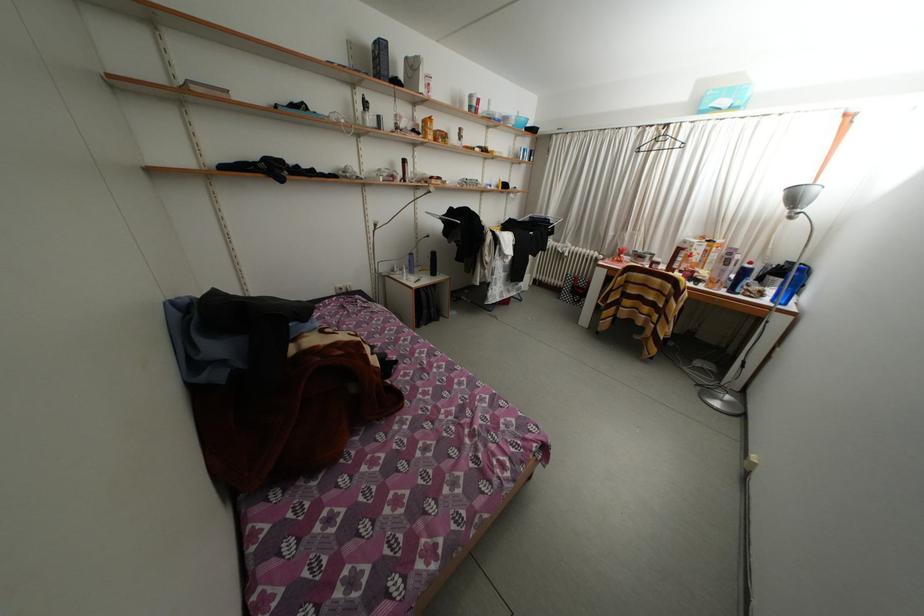
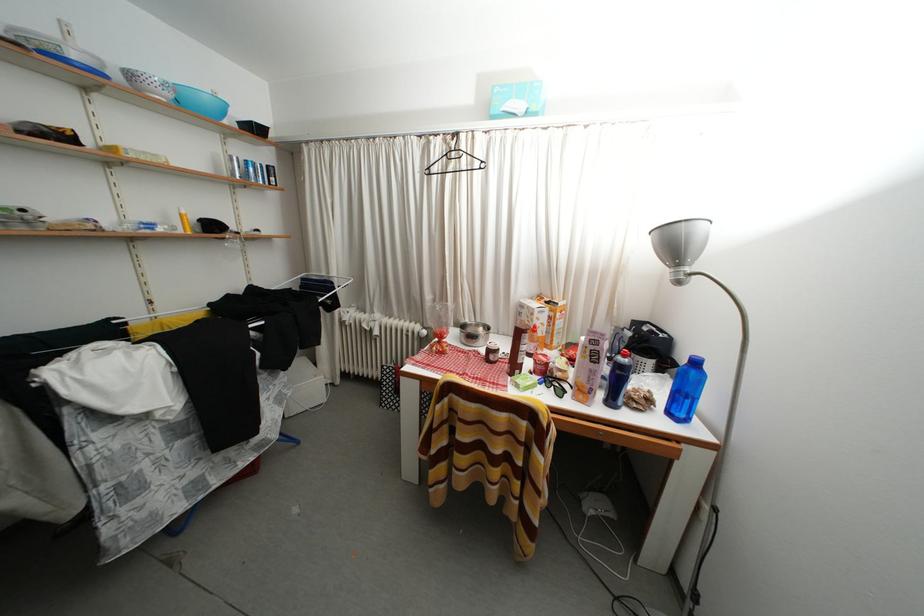
Find the pixel in the second image that matches point (693, 246) in the first image.

(529, 310)